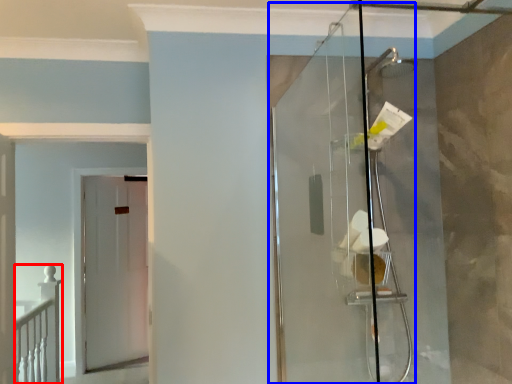
Question: Which of the following is the farthest to the observer, rail (highlighted by a red box) or glass door (highlighted by a blue box)?

Choices:
 (A) rail
 (B) glass door

Answer: (A)